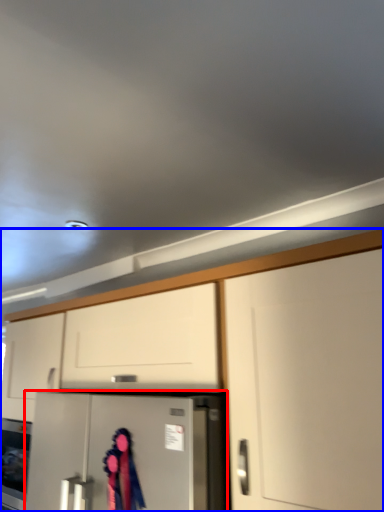
Question: Which of the following is the farthest to the observer, refrigerator (highlighted by a red box) or cabinetry (highlighted by a blue box)?

Choices:
 (A) refrigerator
 (B) cabinetry

Answer: (A)